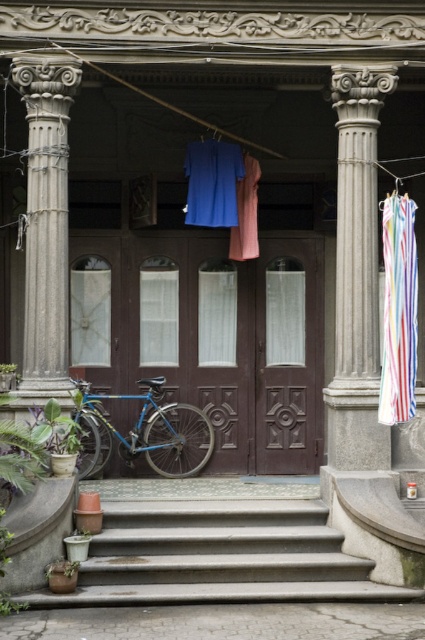
You are standing at the entrance of the building and want to take a photo of the gray stone column at right and the gray stone column at left. Which column should you focus on first if you want to capture both in the frame without moving your camera?

The gray stone column at right is below the gray stone column at left, so you should focus on the gray stone column at left first to ensure both columns are in the frame without moving the camera.